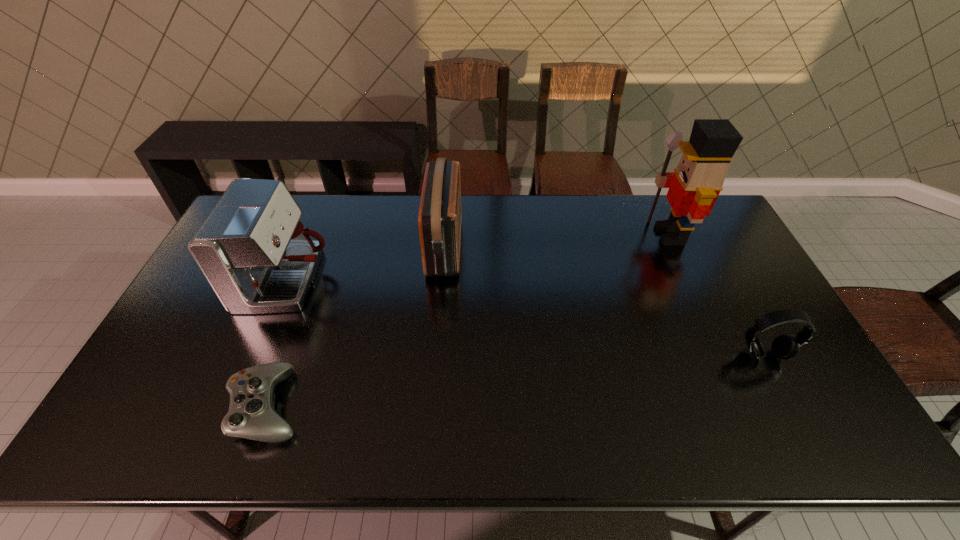
Identify the location of vacant space located 0.310m on the front-facing side of the third object from left to right. The width and height of the screenshot is (960, 540). (553, 246).

In order to click on vacant region located 0.090m on the front of the coffee maker near the spout in this screenshot , I will do pyautogui.click(x=361, y=281).

What are the coordinates of `free space located 0.050m on the ear cups of the fourth farthest object` in the screenshot? It's located at (778, 382).

I want to click on free space located 0.190m on the right of the shortest object, so click(x=382, y=406).

Locate an element on the screen. The image size is (960, 540). nutcracker that is positioned at the far edge is located at coordinates (694, 187).

Find the location of a particular element. radio receiver present at the far edge is located at coordinates (439, 220).

Locate an element on the screen. This screenshot has height=540, width=960. object that is positioned at the near edge is located at coordinates coord(251,415).

Find the location of `object at the left edge`. object at the left edge is located at coordinates (257, 256).

Where is `nutcracker at the right edge`? The height and width of the screenshot is (540, 960). nutcracker at the right edge is located at coordinates (694, 187).

Where is `earphone that is positioned at the right edge`? The width and height of the screenshot is (960, 540). earphone that is positioned at the right edge is located at coordinates (785, 347).